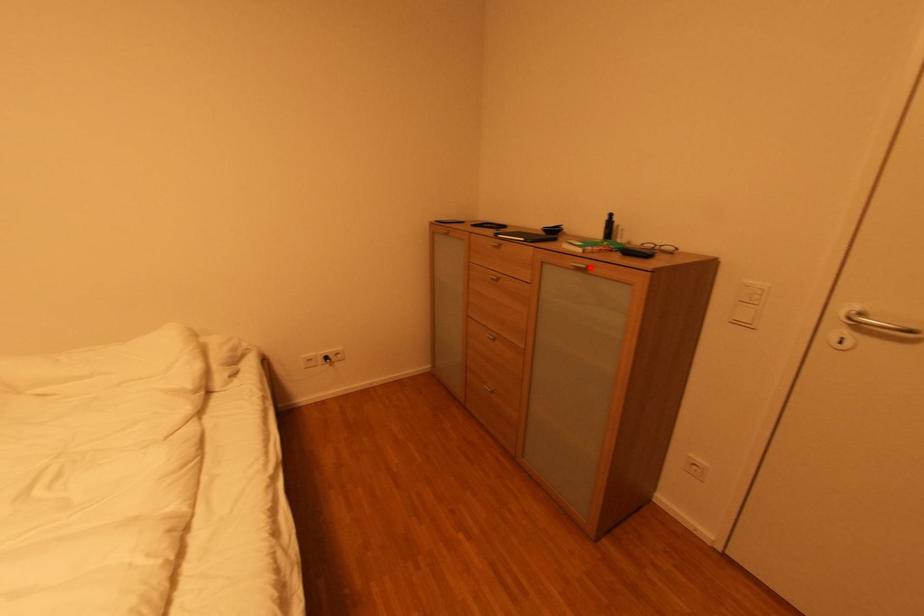
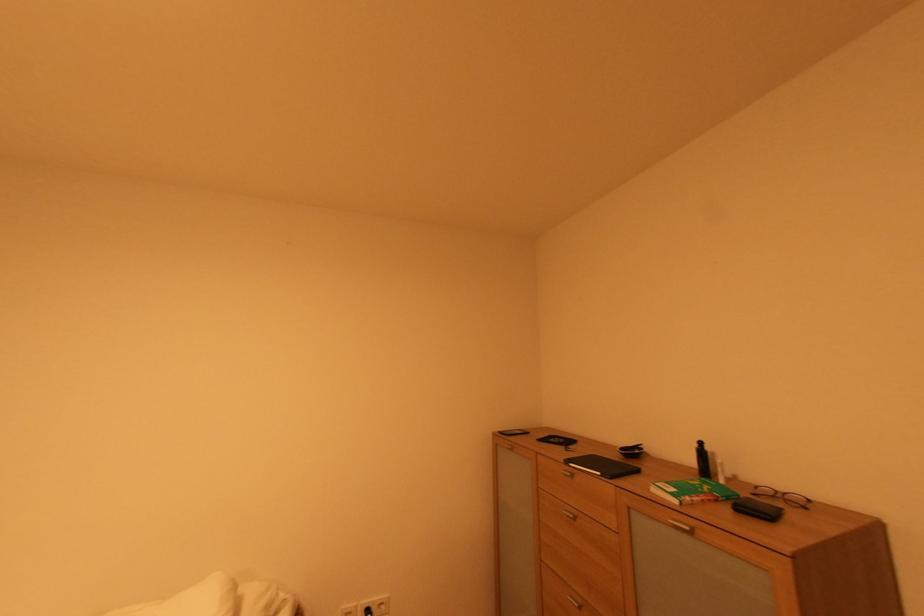
Where in the second image is the point corresponding to the highlighted location from the first image?

(694, 530)